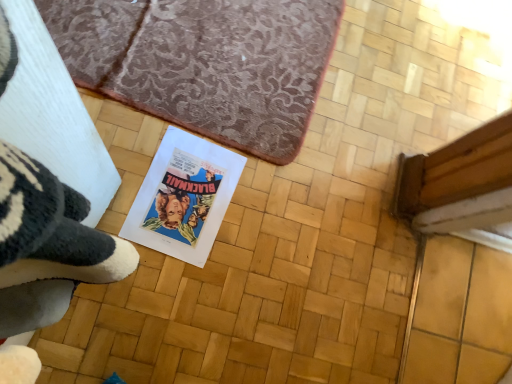
This screenshot has width=512, height=384. I want to click on free point below brown textured rug at upper center (from a real-world perspective), so click(206, 47).